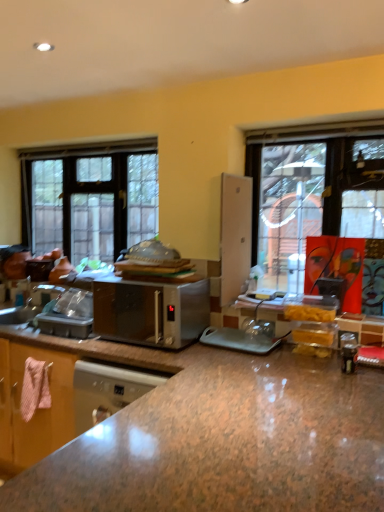
Question: From the image's perspective, is clear glass window at left located above or below satin silver microwave at center?

Choices:
 (A) above
 (B) below

Answer: (A)

Question: Considering the positions of point (89, 181) and point (175, 304), is point (89, 181) closer or farther from the camera than point (175, 304)?

Choices:
 (A) closer
 (B) farther

Answer: (B)

Question: Estimate the real-world distances between objects in this image. Which object is farther from the brown granite countertop at center?

Choices:
 (A) clear glass window at left
 (B) satin silver microwave at center

Answer: (A)

Question: Which of these objects is positioned closest to the brown granite countertop at center?

Choices:
 (A) clear glass window at left
 (B) satin silver microwave at center

Answer: (B)